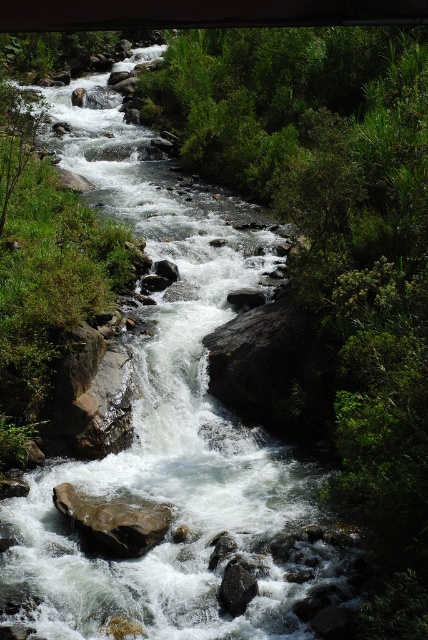
Is brown rough rock at center shorter than black smooth rock at center?

Incorrect, brown rough rock at center's height does not fall short of black smooth rock at center's.

Who is lower down, brown rough rock at center or black smooth rock at center?

black smooth rock at center

Between point (77, 500) and point (225, 609), which one is positioned behind?

Point (77, 500)

Identify the location of brown rough rock at center. (112, 522).